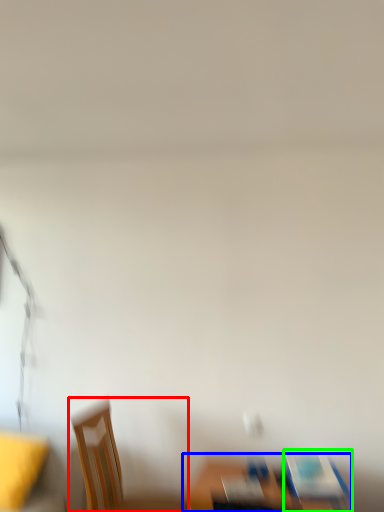
Question: Which is nearer to the chair (highlighted by a red box)? furniture (highlighted by a blue box) or chair (highlighted by a green box).

Choices:
 (A) furniture
 (B) chair

Answer: (A)